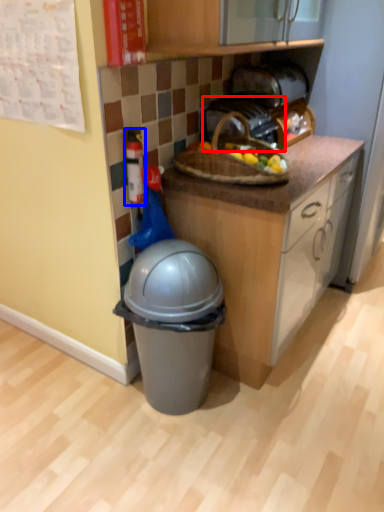
Question: Among these objects, which one is farthest to the camera, toaster (highlighted by a red box) or toy (highlighted by a blue box)?

Choices:
 (A) toaster
 (B) toy

Answer: (A)